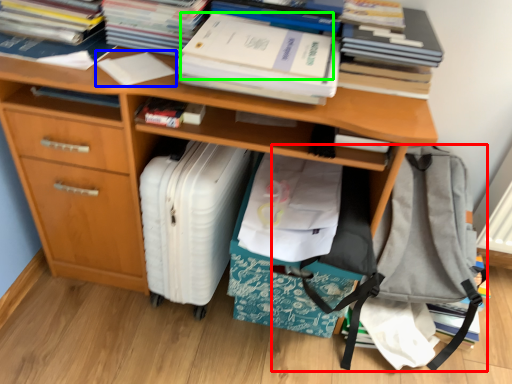
Question: Which is nearer to the messenger bag (highlighted by a red box)? book (highlighted by a blue box) or paperback book (highlighted by a green box).

Choices:
 (A) book
 (B) paperback book

Answer: (B)